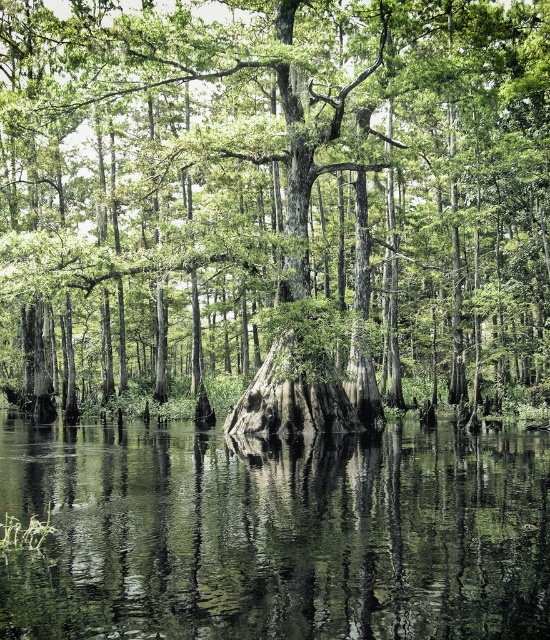
You are standing on a wooden platform observing the swamp scene. You notice the smooth bark tree at center and the green reflective water at center. Which object is closer to you?

The smooth bark tree at center is closer to you because the green reflective water at center is behind it.

You are a bird looking for a nesting spot. You see a smooth bark tree at center and want to land on point [276,200]. Is this point on the smooth bark tree at center?

Yes, the point [276,200] is on the smooth bark tree at center, so the bird can land there.

You are standing in the swamp and want to cross from the smooth bark tree at center to the green reflective water at center. Which direction should you head to reach the water?

The smooth bark tree at center is to the left of green reflective water at center, so you should head to the right to reach the water.